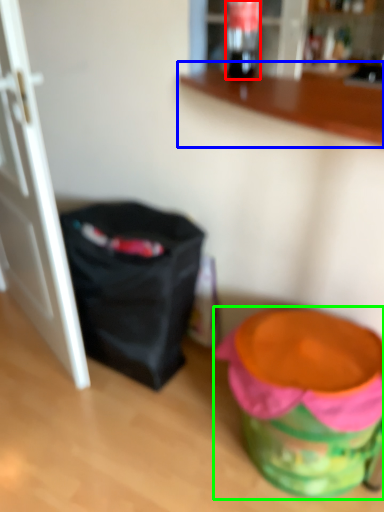
Question: Which object is positioned closest to beverage (highlighted by a red box)? Select from counter (highlighted by a blue box) and potty (highlighted by a green box).

Choices:
 (A) counter
 (B) potty

Answer: (A)